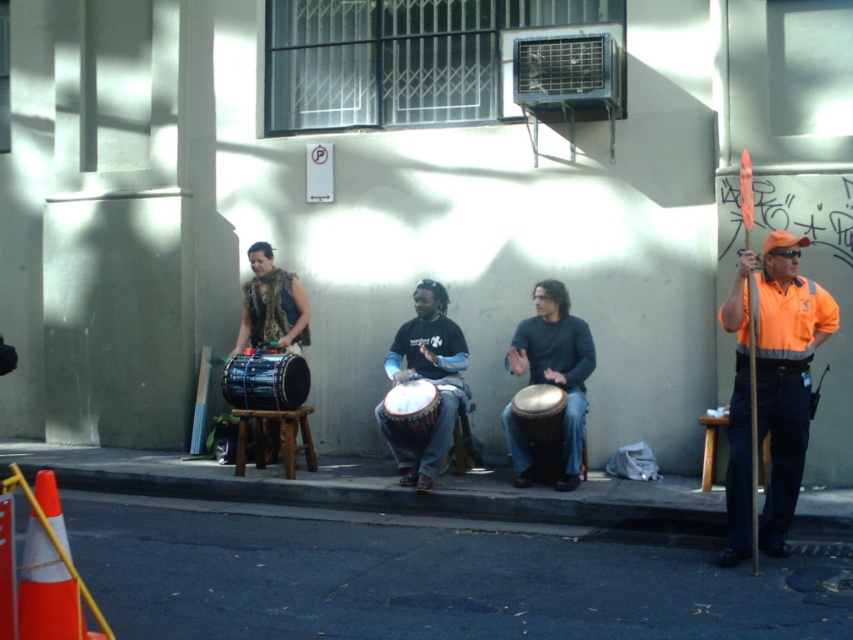
Who is more distant from viewer, (616, 536) or (566, 449)?

The point (566, 449) is more distant.

Which is below, dark asphalt pavement at lower center or dark gray matte drum at center?

dark asphalt pavement at lower center is lower down.

Describe the element at coordinates (426, 579) in the screenshot. This screenshot has height=640, width=853. I see `dark asphalt pavement at lower center` at that location.

At what (x,y) coordinates should I click in order to perform the action: click on dark asphalt pavement at lower center. Please return your answer as a coordinate pair (x, y). The width and height of the screenshot is (853, 640). Looking at the image, I should click on (426, 579).

Looking at this image, between dark gray matte drum at center and matte black drum at center, which one is positioned higher?

Positioned higher is dark gray matte drum at center.

Locate an element on the screen. The height and width of the screenshot is (640, 853). dark gray matte drum at center is located at coordinates (556, 365).

Identify the location of dark gray matte drum at center. Image resolution: width=853 pixels, height=640 pixels. (556, 365).

How much distance is there between orange high-visibility vest at right and dark gray matte drum at center?

orange high-visibility vest at right is 1.80 meters away from dark gray matte drum at center.

Image resolution: width=853 pixels, height=640 pixels. I want to click on orange high-visibility vest at right, so click(785, 372).

Identify the location of orange high-visibility vest at right. The image size is (853, 640). (785, 372).